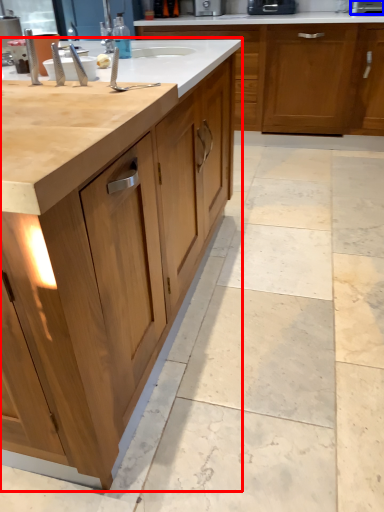
Question: Which point is further to the camera, cabinetry (highlighted by a red box) or appliance (highlighted by a blue box)?

Choices:
 (A) cabinetry
 (B) appliance

Answer: (B)